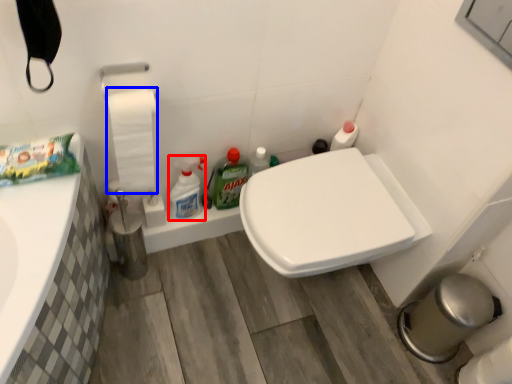
Question: Which of the following is the closest to the observer, cleaning product (highlighted by a red box) or toilet paper (highlighted by a blue box)?

Choices:
 (A) cleaning product
 (B) toilet paper

Answer: (B)